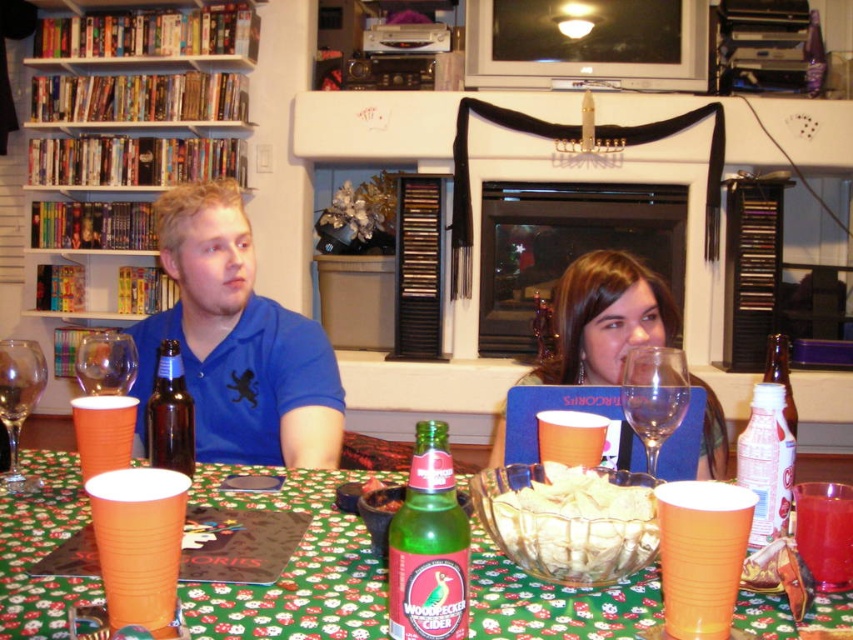
Is the position of orange plastic cup at lower center more distant than that of orange paper cup at lower left?

That is False.

You are a GUI agent. You are given a task and a screenshot of the screen. Output one action in this format:
    pyautogui.click(x=<x>, y=<y>)
    Task: Click on the orange plastic cup at lower center
    
    Given the screenshot: What is the action you would take?
    pyautogui.click(x=701, y=554)

What do you see at coordinates (701, 554) in the screenshot?
I see `orange plastic cup at lower center` at bounding box center [701, 554].

Find the location of a particular element. This screenshot has width=853, height=640. orange plastic cup at lower center is located at coordinates (701, 554).

Does wooden bookshelf at left lie behind brown glass beer bottle at center?

Yes, it is behind brown glass beer bottle at center.

Which is above, wooden bookshelf at left or brown glass beer bottle at center?

Positioned higher is wooden bookshelf at left.

Between point (88, 308) and point (177, 372), which one is positioned behind?

Positioned behind is point (88, 308).

Identify the location of wooden bookshelf at left. This screenshot has width=853, height=640. (148, 120).

Which is more to the left, green glass bottle at table or orange plastic cup at lower left?

Positioned to the left is orange plastic cup at lower left.

Is green glass bottle at table bigger than orange plastic cup at lower left?

Yes, green glass bottle at table is bigger than orange plastic cup at lower left.

Is point (432, 456) less distant than point (122, 488)?

Yes, point (432, 456) is closer to viewer.

The image size is (853, 640). Find the location of `green glass bottle at table`. green glass bottle at table is located at coordinates (428, 547).